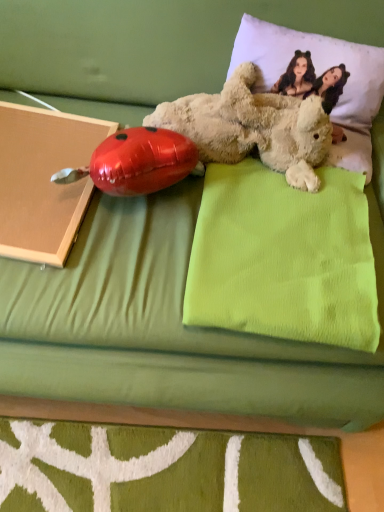
Image resolution: width=384 pixels, height=512 pixels. What are the coordinates of `fluffy beige teddy bear at upper right` in the screenshot? It's located at (253, 127).

I want to click on shiny metallic ladybug at left, so click(138, 162).

The height and width of the screenshot is (512, 384). What do you see at coordinates (319, 75) in the screenshot? I see `white soft pillow at upper right, the 1th pillow viewed from the top` at bounding box center [319, 75].

Describe the element at coordinates (284, 258) in the screenshot. I see `green fabric pillow at upper center, which is the 2th pillow from top to bottom` at that location.

Identify the location of green fabric pillow at upper center, placed as the first pillow when sorted from bottom to top. This screenshot has height=512, width=384. (284, 258).

Where is `fluffy beige teddy bear at upper right`? Image resolution: width=384 pixels, height=512 pixels. fluffy beige teddy bear at upper right is located at coordinates (253, 127).

Does matte cardboard book at left have a larger size compared to shiny metallic ladybug at left?

Correct, matte cardboard book at left is larger in size than shiny metallic ladybug at left.

Between point (14, 138) and point (150, 190), which one is positioned in front?

The point (150, 190) is more forward.

Between matte cardboard book at left and shiny metallic ladybug at left, which one has less height?

matte cardboard book at left is shorter.

Which object is more forward, matte cardboard book at left or shiny metallic ladybug at left?

shiny metallic ladybug at left.

Is fluffy beige teddy bear at upper right smaller than matte cardboard book at left?

No, fluffy beige teddy bear at upper right is not smaller than matte cardboard book at left.

Identify the location of paperback book on the left of fluffy beige teddy bear at upper right. (43, 180).

Is fluffy beige teddy bear at upper right positioned in front of matte cardboard book at left?

No, fluffy beige teddy bear at upper right is behind matte cardboard book at left.

Is fluffy beige teddy bear at upper right aimed at matte cardboard book at left?

No, fluffy beige teddy bear at upper right is not facing towards matte cardboard book at left.

Is white soft pillow at upper right, the 1th pillow viewed from the top, positioned behind shiny metallic ladybug at left?

Yes, white soft pillow at upper right, the 1th pillow viewed from the top, is further from the viewer.

Measure the distance from white soft pillow at upper right, which is counted as the second pillow, starting from the bottom, to shiny metallic ladybug at left.

The distance of white soft pillow at upper right, which is counted as the second pillow, starting from the bottom, from shiny metallic ladybug at left is 13.35 inches.

Does point (360, 70) appear closer or farther from the camera than point (167, 185)?

Point (360, 70) is farther from the camera than point (167, 185).

Would you say white soft pillow at upper right, the 1th pillow viewed from the top, is outside shiny metallic ladybug at left?

That's correct, white soft pillow at upper right, the 1th pillow viewed from the top, is outside of shiny metallic ladybug at left.

Consider the image. Is white soft pillow at upper right, which is counted as the second pillow, starting from the bottom, oriented towards fluffy beige teddy bear at upper right?

Yes, white soft pillow at upper right, which is counted as the second pillow, starting from the bottom, is oriented towards fluffy beige teddy bear at upper right.

Based on their sizes in the image, would you say white soft pillow at upper right, which is counted as the second pillow, starting from the bottom, is bigger or smaller than fluffy beige teddy bear at upper right?

Considering their sizes, white soft pillow at upper right, which is counted as the second pillow, starting from the bottom, takes up more space than fluffy beige teddy bear at upper right.

Considering the sizes of objects white soft pillow at upper right, the 1th pillow viewed from the top, and fluffy beige teddy bear at upper right in the image provided, who is taller, white soft pillow at upper right, the 1th pillow viewed from the top, or fluffy beige teddy bear at upper right?

white soft pillow at upper right, the 1th pillow viewed from the top.

Considering the positions of objects white soft pillow at upper right, which is counted as the second pillow, starting from the bottom, and fluffy beige teddy bear at upper right in the image provided, who is more to the right, white soft pillow at upper right, which is counted as the second pillow, starting from the bottom, or fluffy beige teddy bear at upper right?

From the viewer's perspective, white soft pillow at upper right, which is counted as the second pillow, starting from the bottom, appears more on the right side.

Does green fabric pillow at upper center, placed as the first pillow when sorted from bottom to top, have a lesser width compared to shiny metallic ladybug at left?

Incorrect, the width of green fabric pillow at upper center, placed as the first pillow when sorted from bottom to top, is not less than that of shiny metallic ladybug at left.

How much distance is there between green fabric pillow at upper center, placed as the first pillow when sorted from bottom to top, and shiny metallic ladybug at left?

green fabric pillow at upper center, placed as the first pillow when sorted from bottom to top, and shiny metallic ladybug at left are 8.68 inches apart from each other.

From the image's perspective, is green fabric pillow at upper center, placed as the first pillow when sorted from bottom to top, on shiny metallic ladybug at left?

No, from the image's perspective, green fabric pillow at upper center, placed as the first pillow when sorted from bottom to top, is not over shiny metallic ladybug at left.

Relative to shiny metallic ladybug at left, is green fabric pillow at upper center, placed as the first pillow when sorted from bottom to top, in front or behind?

In the image, green fabric pillow at upper center, placed as the first pillow when sorted from bottom to top, appears in front of shiny metallic ladybug at left.

Considering the sizes of green fabric pillow at upper center, which is the 2th pillow from top to bottom, and white soft pillow at upper right, the 1th pillow viewed from the top, in the image, is green fabric pillow at upper center, which is the 2th pillow from top to bottom, bigger or smaller than white soft pillow at upper right, the 1th pillow viewed from the top,?

Clearly, green fabric pillow at upper center, which is the 2th pillow from top to bottom, is larger in size than white soft pillow at upper right, the 1th pillow viewed from the top.

How many degrees apart are the facing directions of green fabric pillow at upper center, which is the 2th pillow from top to bottom, and white soft pillow at upper right, the 1th pillow viewed from the top?

They differ by 0.000513 degrees in their facing directions.

Which of these two, green fabric pillow at upper center, which is the 2th pillow from top to bottom, or white soft pillow at upper right, the 1th pillow viewed from the top, is thinner?

white soft pillow at upper right, the 1th pillow viewed from the top.

Would you say green fabric pillow at upper center, which is the 2th pillow from top to bottom, is outside white soft pillow at upper right, which is counted as the second pillow, starting from the bottom?

green fabric pillow at upper center, which is the 2th pillow from top to bottom, is positioned outside white soft pillow at upper right, which is counted as the second pillow, starting from the bottom.

Does shiny metallic ladybug at left have a lesser height compared to matte cardboard book at left?

No, shiny metallic ladybug at left is not shorter than matte cardboard book at left.

The width and height of the screenshot is (384, 512). I want to click on paperback book that appears on the left of shiny metallic ladybug at left, so click(x=43, y=180).

How different are the orientations of shiny metallic ladybug at left and matte cardboard book at left in degrees?

The angle between the facing direction of shiny metallic ladybug at left and the facing direction of matte cardboard book at left is 0.000266 degrees.

Identify the location of ladybug located in front of the matte cardboard book at left. The image size is (384, 512). (138, 162).

Image resolution: width=384 pixels, height=512 pixels. In the image, there is a fluffy beige teddy bear at upper right. Identify the location of paperback book below it (from the image's perspective). (43, 180).

Looking at the image, which one is located further to white soft pillow at upper right, the 1th pillow viewed from the top, green fabric pillow at upper center, which is the 2th pillow from top to bottom, or shiny metallic ladybug at left?

shiny metallic ladybug at left lies further to white soft pillow at upper right, the 1th pillow viewed from the top, than the other object.

Looking at the image, which one is located further to white soft pillow at upper right, the 1th pillow viewed from the top, fluffy beige teddy bear at upper right or green fabric pillow at upper center, placed as the first pillow when sorted from bottom to top?

green fabric pillow at upper center, placed as the first pillow when sorted from bottom to top, is positioned further to the anchor white soft pillow at upper right, the 1th pillow viewed from the top.

From the picture: Looking at the image, which one is located further to shiny metallic ladybug at left, white soft pillow at upper right, which is counted as the second pillow, starting from the bottom, or matte cardboard book at left?

The object further to shiny metallic ladybug at left is white soft pillow at upper right, which is counted as the second pillow, starting from the bottom.

From the image, which object appears to be nearer to fluffy beige teddy bear at upper right, shiny metallic ladybug at left or matte cardboard book at left?

shiny metallic ladybug at left is positioned closer to the anchor fluffy beige teddy bear at upper right.

Which object lies further to the anchor point matte cardboard book at left, fluffy beige teddy bear at upper right or white soft pillow at upper right, which is counted as the second pillow, starting from the bottom?

Based on the image, white soft pillow at upper right, which is counted as the second pillow, starting from the bottom, appears to be further to matte cardboard book at left.

Considering their positions, is green fabric pillow at upper center, which is the 2th pillow from top to bottom, positioned closer to fluffy beige teddy bear at upper right than matte cardboard book at left?

Among the two, green fabric pillow at upper center, which is the 2th pillow from top to bottom, is located nearer to fluffy beige teddy bear at upper right.

Estimate the real-world distances between objects in this image. Which object is closer to matte cardboard book at left, green fabric pillow at upper center, which is the 2th pillow from top to bottom, or shiny metallic ladybug at left?

shiny metallic ladybug at left lies closer to matte cardboard book at left than the other object.

From the image, which object appears to be nearer to green fabric pillow at upper center, placed as the first pillow when sorted from bottom to top, white soft pillow at upper right, the 1th pillow viewed from the top, or shiny metallic ladybug at left?

shiny metallic ladybug at left is positioned closer to the anchor green fabric pillow at upper center, placed as the first pillow when sorted from bottom to top.

This screenshot has width=384, height=512. I want to click on teddy bear between shiny metallic ladybug at left and white soft pillow at upper right, which is counted as the second pillow, starting from the bottom, from left to right, so click(253, 127).

The image size is (384, 512). Identify the location of teddy bear between matte cardboard book at left and white soft pillow at upper right, the 1th pillow viewed from the top. (253, 127).

At what (x,y) coordinates should I click in order to perform the action: click on teddy bear between white soft pillow at upper right, which is counted as the second pillow, starting from the bottom, and green fabric pillow at upper center, placed as the first pillow when sorted from bottom to top, from top to bottom. Please return your answer as a coordinate pair (x, y). Looking at the image, I should click on (253, 127).

The image size is (384, 512). What are the coordinates of `ladybug between matte cardboard book at left and green fabric pillow at upper center, placed as the first pillow when sorted from bottom to top, from left to right` in the screenshot? It's located at (138, 162).